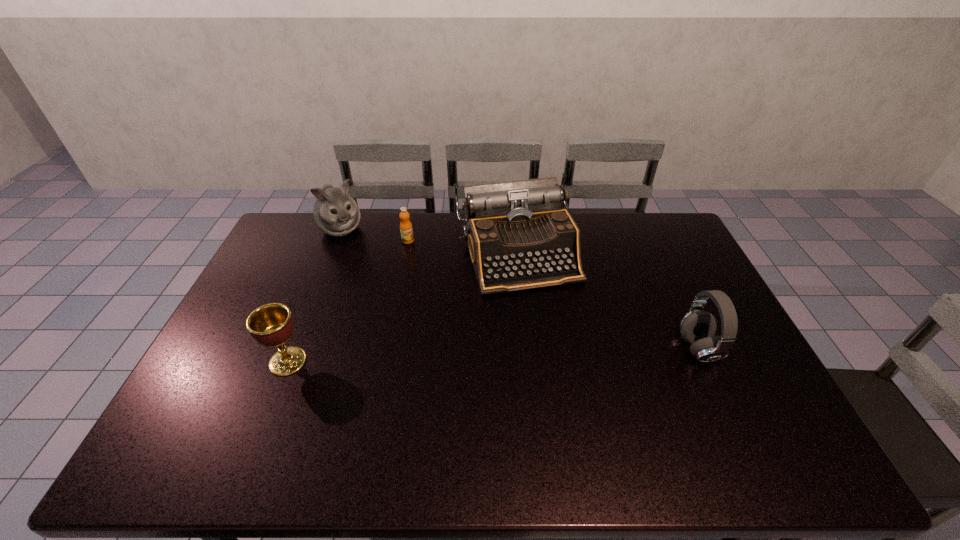
The height and width of the screenshot is (540, 960). Identify the location of free space on the desktop that is between the chalice and the rightmost object and is positioned on the keyboard of the typewriter. (555, 353).

You are a GUI agent. You are given a task and a screenshot of the screen. Output one action in this format:
    pyautogui.click(x=<x>, y=<y>)
    Task: Click on the vacant space on the desktop that is between the chalice and the headset and is positioned on the front label of the third object from left to right
    The width and height of the screenshot is (960, 540).
    Given the screenshot: What is the action you would take?
    [x=492, y=355]

Find the location of a particular element. Image resolution: width=960 pixels, height=540 pixels. vacant space on the desktop that is between the chalice and the headset and is positioned on the face of the hamster is located at coordinates (434, 357).